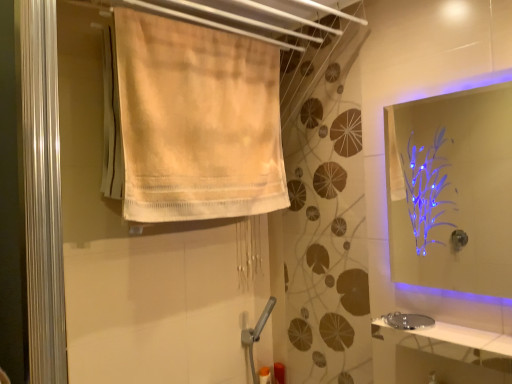
At what (x,y) coordinates should I click in order to perform the action: click on transparent acrylic mirror at upper right. Please return your answer as a coordinate pair (x, y). This screenshot has width=512, height=384. Looking at the image, I should click on (452, 190).

What do you see at coordinates (197, 121) in the screenshot? I see `beige cotton towel at upper left` at bounding box center [197, 121].

The width and height of the screenshot is (512, 384). In order to click on transparent acrylic mirror at upper right in this screenshot , I will do `click(452, 190)`.

Is point (393, 321) positioned after point (178, 138)?

Yes.

From the image's perspective, between silver metallic sink at lower right and beige cotton towel at upper left, who is located below?

silver metallic sink at lower right, from the image's perspective.

Is silver metallic sink at lower right smaller than beige cotton towel at upper left?

Yes, silver metallic sink at lower right is smaller than beige cotton towel at upper left.

Can you confirm if silver metallic sink at lower right is taller than beige cotton towel at upper left?

Incorrect, the height of silver metallic sink at lower right is not larger of that of beige cotton towel at upper left.

Can you confirm if translucent plastic bottle at lower center is positioned to the left of transparent acrylic mirror at upper right?

Yes, translucent plastic bottle at lower center is to the left of transparent acrylic mirror at upper right.

Is translucent plastic bottle at lower center positioned far away from transparent acrylic mirror at upper right?

translucent plastic bottle at lower center is positioned a significant distance from transparent acrylic mirror at upper right.

From a real-world perspective, is translucent plastic bottle at lower center above or below transparent acrylic mirror at upper right?

Clearly, from a real-world perspective, translucent plastic bottle at lower center is below transparent acrylic mirror at upper right.

Looking at their sizes, would you say translucent plastic bottle at lower center is wider or thinner than transparent acrylic mirror at upper right?

In the image, translucent plastic bottle at lower center appears to be wider than transparent acrylic mirror at upper right.

Between white glossy counter top at lower right and transparent acrylic mirror at upper right, which one appears on the right side from the viewer's perspective?

From the viewer's perspective, transparent acrylic mirror at upper right appears more on the right side.

Which object is wider, white glossy counter top at lower right or transparent acrylic mirror at upper right?

Wider between the two is white glossy counter top at lower right.

Can you confirm if white glossy counter top at lower right is shorter than transparent acrylic mirror at upper right?

Yes, white glossy counter top at lower right is shorter than transparent acrylic mirror at upper right.

Is transparent acrylic mirror at upper right at the back of white glossy counter top at lower right?

No.

Considering the relative positions of beige cotton towel at upper left and white glossy counter top at lower right in the image provided, is beige cotton towel at upper left to the left of white glossy counter top at lower right from the viewer's perspective?

Yes.

In terms of size, does beige cotton towel at upper left appear bigger or smaller than white glossy counter top at lower right?

beige cotton towel at upper left is bigger than white glossy counter top at lower right.

Which is behind, beige cotton towel at upper left or transparent acrylic mirror at upper right?

beige cotton towel at upper left is further away from the camera.

From the image's perspective, is beige cotton towel at upper left over transparent acrylic mirror at upper right?

Yes.

From a real-world perspective, is beige cotton towel at upper left located higher than transparent acrylic mirror at upper right?

Yes, from a real-world perspective, beige cotton towel at upper left is above transparent acrylic mirror at upper right.

Consider the image. Considering the positions of objects translucent plastic bottle at lower center and white glossy counter top at lower right in the image provided, who is more to the left, translucent plastic bottle at lower center or white glossy counter top at lower right?

From the viewer's perspective, translucent plastic bottle at lower center appears more on the left side.

Is point (284, 383) positioned behind point (505, 340)?

That is True.

Is translucent plastic bottle at lower center further to the viewer compared to white glossy counter top at lower right?

Yes, translucent plastic bottle at lower center is behind white glossy counter top at lower right.

Between silver metallic sink at lower right and translucent plastic bottle at lower center, which one appears on the right side from the viewer's perspective?

silver metallic sink at lower right is more to the right.

Would you consider silver metallic sink at lower right to be distant from translucent plastic bottle at lower center?

silver metallic sink at lower right is near translucent plastic bottle at lower center, not far away.

How different are the orientations of silver metallic sink at lower right and translucent plastic bottle at lower center in degrees?

90 degrees separate the facing orientations of silver metallic sink at lower right and translucent plastic bottle at lower center.

Where is `curtain above the silver metallic sink at lower right (from a real-world perspective)`? The height and width of the screenshot is (384, 512). curtain above the silver metallic sink at lower right (from a real-world perspective) is located at coordinates (x=197, y=121).

This screenshot has width=512, height=384. Identify the location of mirror above the translucent plastic bottle at lower center (from the image's perspective). (452, 190).

Which object lies further to the anchor point silver metallic sink at lower right, beige cotton towel at upper left or transparent acrylic mirror at upper right?

Based on the image, transparent acrylic mirror at upper right appears to be further to silver metallic sink at lower right.

Looking at the image, which one is located further to translucent plastic bottle at lower center, white glossy counter top at lower right or transparent acrylic mirror at upper right?

Based on the image, transparent acrylic mirror at upper right appears to be further to translucent plastic bottle at lower center.

When comparing their distances from silver metallic sink at lower right, does beige cotton towel at upper left or translucent plastic bottle at lower center seem closer?

translucent plastic bottle at lower center lies closer to silver metallic sink at lower right than the other object.

Which object lies further to the anchor point translucent plastic bottle at lower center, white glossy counter top at lower right or silver metallic sink at lower right?

Among the two, white glossy counter top at lower right is located further to translucent plastic bottle at lower center.

When comparing their distances from translucent plastic bottle at lower center, does beige cotton towel at upper left or transparent acrylic mirror at upper right seem closer?

The object closer to translucent plastic bottle at lower center is beige cotton towel at upper left.

From the image, which object appears to be farther from transparent acrylic mirror at upper right, translucent plastic bottle at lower center or white glossy counter top at lower right?

translucent plastic bottle at lower center lies further to transparent acrylic mirror at upper right than the other object.

Which object lies nearer to the anchor point white glossy counter top at lower right, translucent plastic bottle at lower center or silver metallic sink at lower right?

silver metallic sink at lower right.

Based on the photo, based on their spatial positions, is transparent acrylic mirror at upper right or white glossy counter top at lower right further from silver metallic sink at lower right?

Based on the image, transparent acrylic mirror at upper right appears to be further to silver metallic sink at lower right.

Find the location of `mirror that lies between beige cotton towel at upper left and translucent plastic bottle at lower center from top to bottom`. mirror that lies between beige cotton towel at upper left and translucent plastic bottle at lower center from top to bottom is located at coordinates (452, 190).

The width and height of the screenshot is (512, 384). What are the coordinates of `sink between transparent acrylic mirror at upper right and white glossy counter top at lower right vertically` in the screenshot? It's located at (408, 321).

Locate an element on the screen. counter top between beige cotton towel at upper left and translucent plastic bottle at lower center in the vertical direction is located at coordinates (468, 337).

Where is `sink between white glossy counter top at lower right and translucent plastic bottle at lower center from front to back`? This screenshot has width=512, height=384. sink between white glossy counter top at lower right and translucent plastic bottle at lower center from front to back is located at coordinates (408, 321).